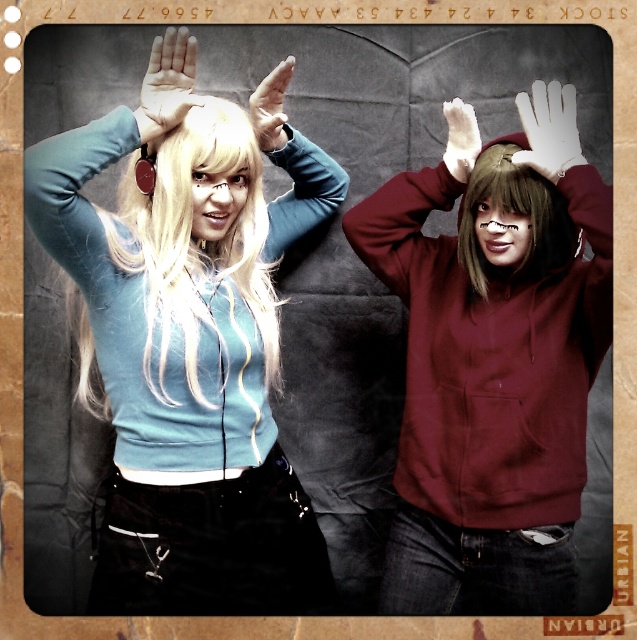
You are a photographer adjusting the lighting for a photo shoot. You notice the white leather glove at upper center and the matte black hand at upper center in the frame. Which object is closer to the camera lens?

The matte black hand at upper center is closer to the camera lens because the white leather glove at upper center is positioned under it, indicating it is behind the hand.

You are a photographer adjusting the lighting for a photo shoot. You notice the blonde silky hair at left and dark brown straight hair at upper right in the frame. Which hair is positioned higher in the image?

The blonde silky hair at left is positioned higher in the image as it is much taller than the dark brown straight hair at upper right.